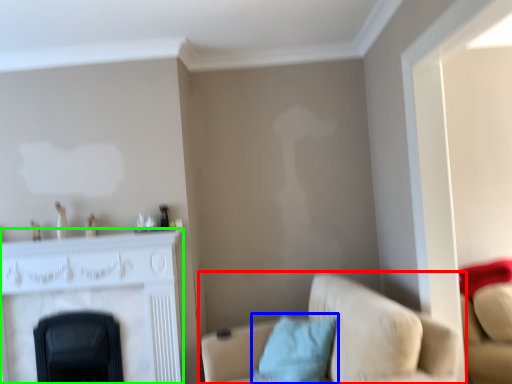
Question: Considering the real-world distances, which object is farthest from studio couch (highlighted by a red box)? pillow (highlighted by a blue box) or fireplace (highlighted by a green box)?

Choices:
 (A) pillow
 (B) fireplace

Answer: (B)